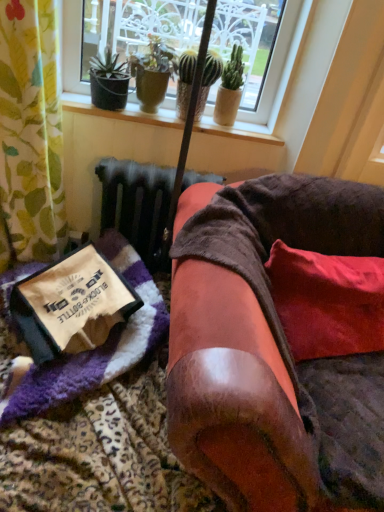
This screenshot has width=384, height=512. What are the coordinates of `vacant space situated above wooden at upper center (from a real-world perspective)` in the screenshot? It's located at (185, 116).